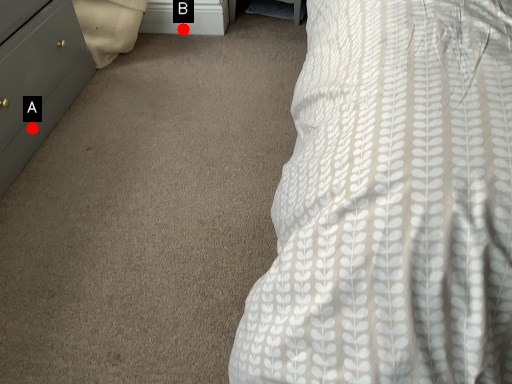
Question: Two points are circled on the image, labeled by A and B beside each circle. Among these points, which one is nearest to the camera?

Choices:
 (A) A is closer
 (B) B is closer

Answer: (A)